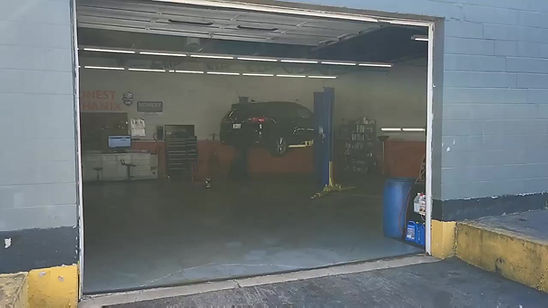
Image resolution: width=548 pixels, height=308 pixels. Find the location of `shelving`. shelving is located at coordinates (407, 238), (411, 210).